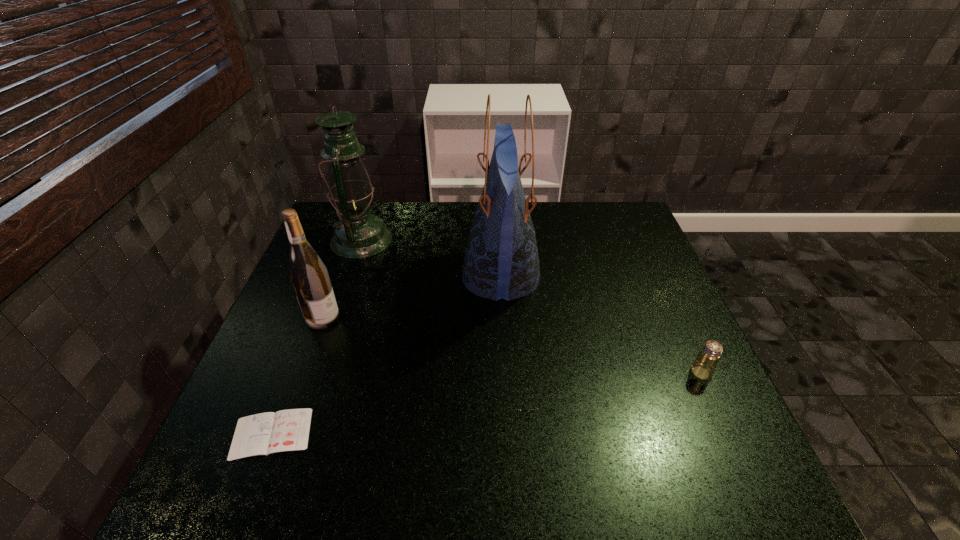
Where is `free space located on the back of the third tallest object`? free space located on the back of the third tallest object is located at coordinates click(354, 231).

Locate an element on the screen. free point located on the left of the saltshaker is located at coordinates (517, 373).

Find the location of a particular element. Image resolution: width=960 pixels, height=540 pixels. vacant region located on the right of the nearest object is located at coordinates (407, 434).

At what (x,y) coordinates should I click in order to perform the action: click on shopping bag that is at the far edge. Please return your answer as a coordinate pair (x, y). This screenshot has height=540, width=960. Looking at the image, I should click on (501, 261).

Where is `oil lamp positioned at the far edge`? The image size is (960, 540). oil lamp positioned at the far edge is located at coordinates (358, 234).

Locate an element on the screen. The height and width of the screenshot is (540, 960). object located in the near edge section of the desktop is located at coordinates (287, 430).

The image size is (960, 540). What are the coordinates of `oil lamp located at the left edge` in the screenshot? It's located at (358, 234).

The width and height of the screenshot is (960, 540). Identify the location of wine bottle at the left edge. (308, 274).

Where is `diary positioned at the left edge`? diary positioned at the left edge is located at coordinates (287, 430).

Find the location of a particular element. object located in the right edge section of the desktop is located at coordinates (703, 367).